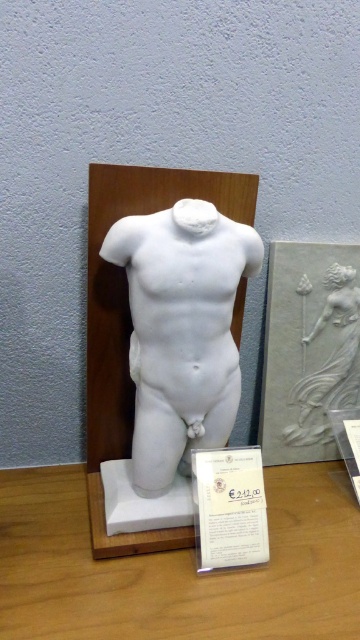
You are an art collector standing in front of the sculpture and want to read the price tag. Which object is closer to you, the wooden table at center or the white marble torso at center?

The wooden table at center is closer to the viewer than the white marble torso at center, so you can reach the wooden table at center first to read the price tag.